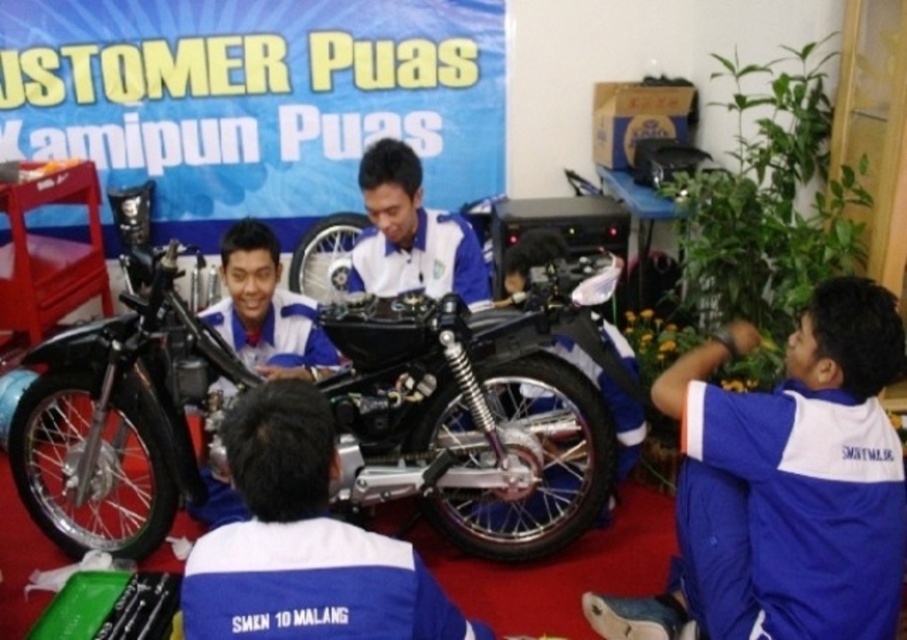
Who is higher up, shiny black motorcycle at center or blue jersey at lower right?

shiny black motorcycle at center is higher up.

Which is below, shiny black motorcycle at center or blue jersey at lower right?

blue jersey at lower right

At what (x,y) coordinates should I click in order to perform the action: click on shiny black motorcycle at center. Please return your answer as a coordinate pair (x, y). The height and width of the screenshot is (640, 907). Looking at the image, I should click on (472, 419).

Identify the location of shiny black motorcycle at center. The width and height of the screenshot is (907, 640). (472, 419).

Is blue jersey at lower right smaller than blue/white uniform at center?

Incorrect, blue jersey at lower right is not smaller in size than blue/white uniform at center.

Does point (857, 579) come closer to viewer compared to point (256, 358)?

That is True.

Is point (774, 388) behind point (221, 300)?

No, it is in front of (221, 300).

At what (x,y) coordinates should I click in order to perform the action: click on blue jersey at lower right. Please return your answer as a coordinate pair (x, y). Looking at the image, I should click on (784, 484).

Who is more distant from viewer, (467, 497) or (233, 244)?

Positioned behind is point (233, 244).

Does point (363, 355) come closer to viewer compared to point (264, 266)?

Yes, it is in front of point (264, 266).

The width and height of the screenshot is (907, 640). Find the location of `shiny black motorcycle at center`. shiny black motorcycle at center is located at coordinates (472, 419).